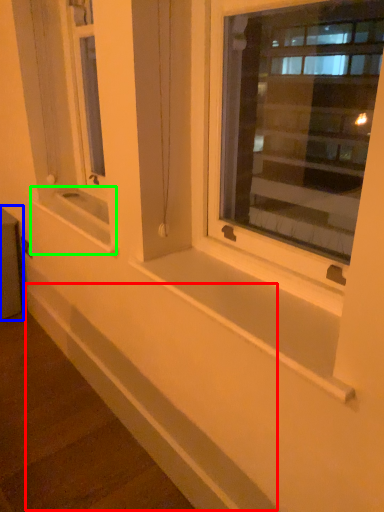
Question: Which is farther away from ledge (highlighted by a red box)? window box (highlighted by a blue box) or window sill (highlighted by a green box)?

Choices:
 (A) window box
 (B) window sill

Answer: (A)